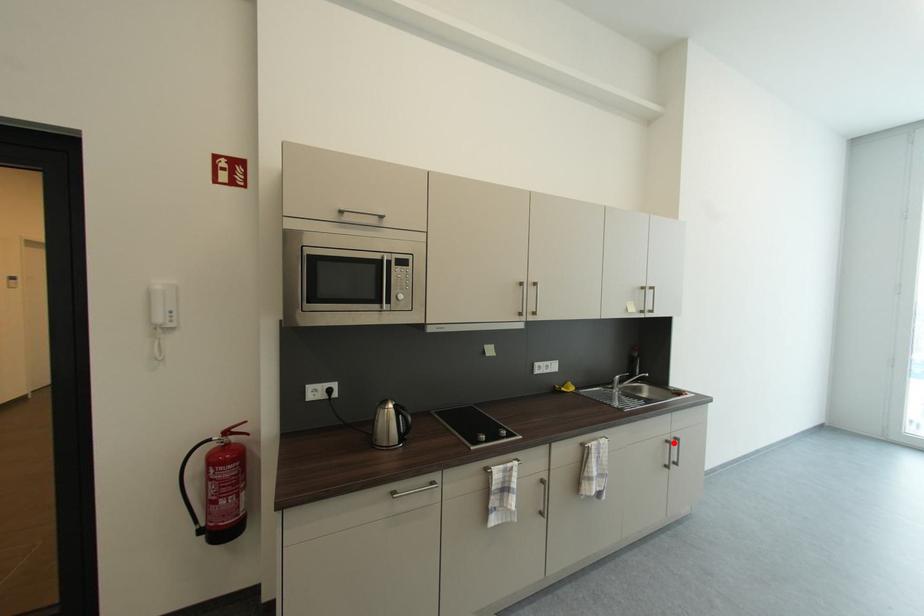
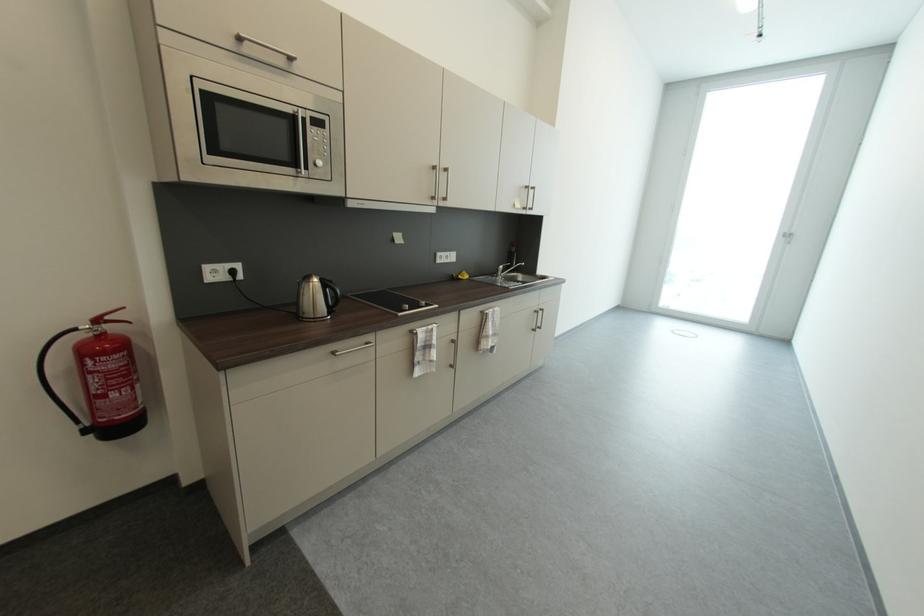
Locate, in the second image, the point that corresponds to the highlighted location in the first image.

(541, 313)